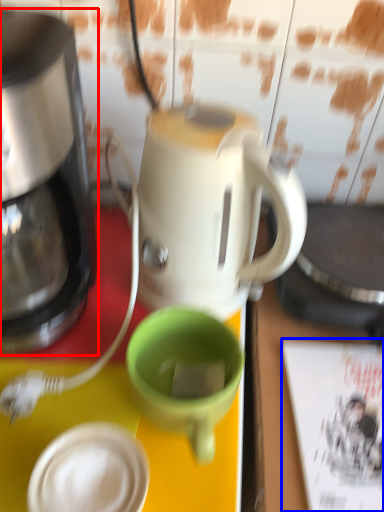
Question: Which object appears closest to the camera in this image, coffee maker (highlighted by a red box) or magazine (highlighted by a blue box)?

Choices:
 (A) coffee maker
 (B) magazine

Answer: (A)